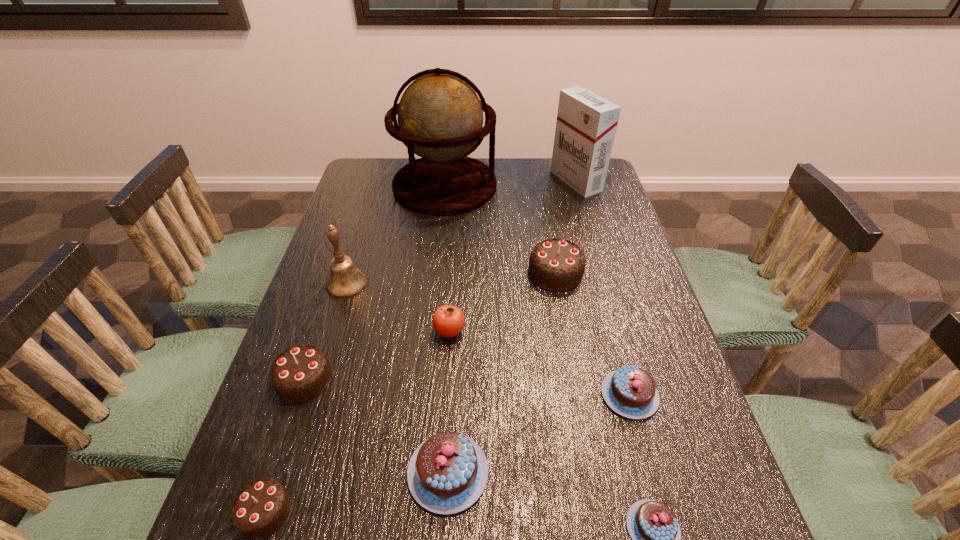
Identify the location of globe. (440, 117).

Where is `cigarette case`? This screenshot has width=960, height=540. cigarette case is located at coordinates (586, 124).

The image size is (960, 540). What are the coordinates of `the eighth shortest object` in the screenshot? It's located at (345, 280).

Identify the location of the rightmost chocolate chocolate cake. This screenshot has height=540, width=960. (556, 264).

This screenshot has width=960, height=540. What are the coordinates of `the tallest chocolate cake` in the screenshot? It's located at (556, 264).

The width and height of the screenshot is (960, 540). What are the coordinates of `the fifth farthest object` in the screenshot? It's located at (448, 320).

Where is `the second nearest chocolate chocolate cake`? Image resolution: width=960 pixels, height=540 pixels. the second nearest chocolate chocolate cake is located at coordinates (301, 372).

This screenshot has width=960, height=540. I want to click on the biggest pink chocolate cake, so click(x=447, y=473).

Locate an element on the screen. The image size is (960, 540). the leftmost pink chocolate cake is located at coordinates (447, 473).

Image resolution: width=960 pixels, height=540 pixels. Find the location of `the farthest pink chocolate cake`. the farthest pink chocolate cake is located at coordinates (630, 391).